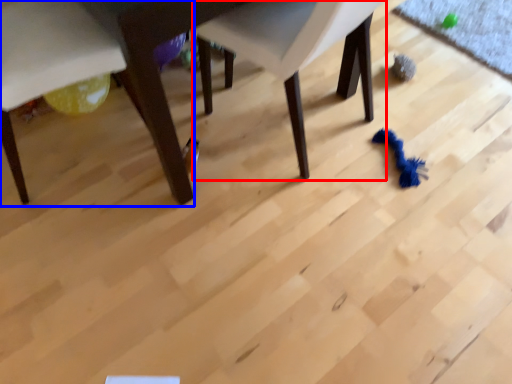
Question: Which point is further to the camera, chair (highlighted by a red box) or chair (highlighted by a blue box)?

Choices:
 (A) chair
 (B) chair

Answer: (B)